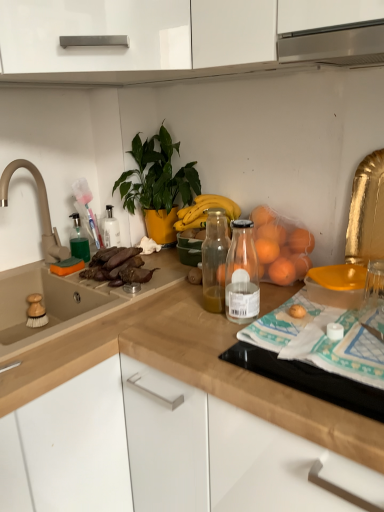
The height and width of the screenshot is (512, 384). I want to click on free space above wooden at upper center, which is counted as the first countertop, starting from the bottom (from a real-world perspective), so click(x=217, y=313).